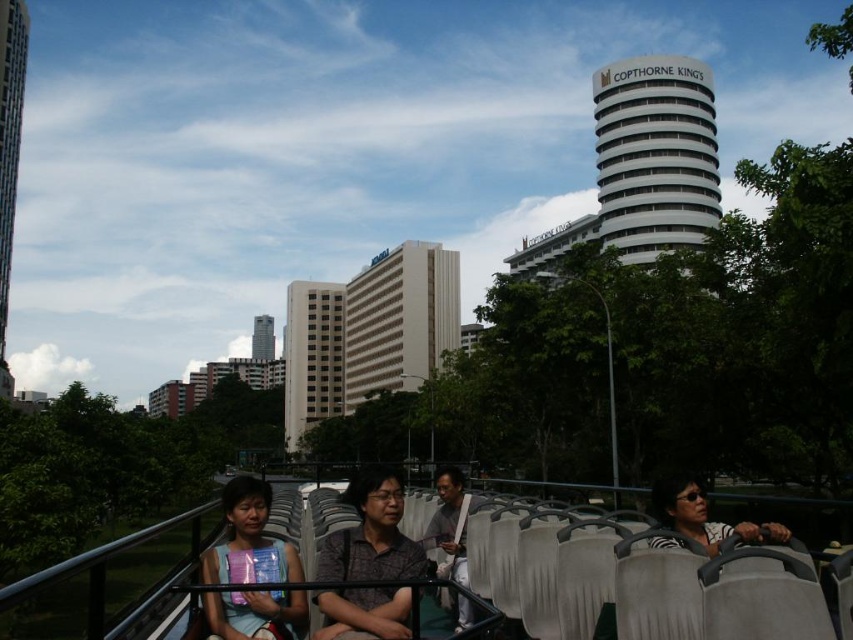
Question: Does dark gray fabric shirt at center have a smaller size compared to zebra print shirt at center?

Choices:
 (A) yes
 (B) no

Answer: (A)

Question: Among these points, which one is nearest to the camera?

Choices:
 (A) (358, 577)
 (B) (242, 481)

Answer: (A)

Question: Does black plastic rail at lower center have a smaller size compared to zebra print shirt at center?

Choices:
 (A) no
 (B) yes

Answer: (A)

Question: Among these points, which one is nearest to the camera?

Choices:
 (A) (457, 497)
 (B) (231, 570)
 (C) (664, 538)
 (D) (354, 506)

Answer: (C)

Question: Which object is farther from the camera taking this photo?

Choices:
 (A) zebra print shirt at center
 (B) gray fabric bag at center
 (C) dark gray fabric shirt at center

Answer: (C)

Question: Does dark gray fabric shirt at center have a lesser width compared to gray fabric bag at center?

Choices:
 (A) no
 (B) yes

Answer: (B)